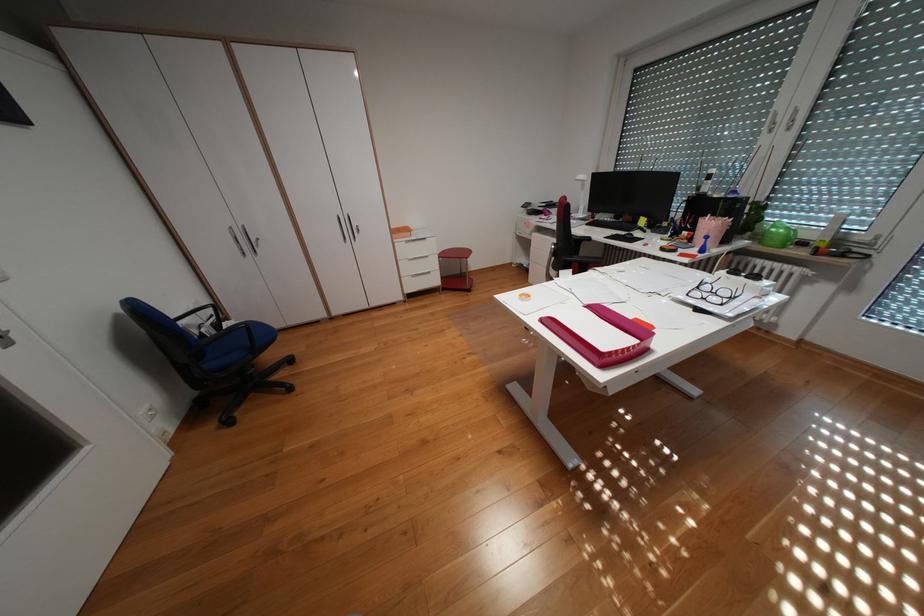
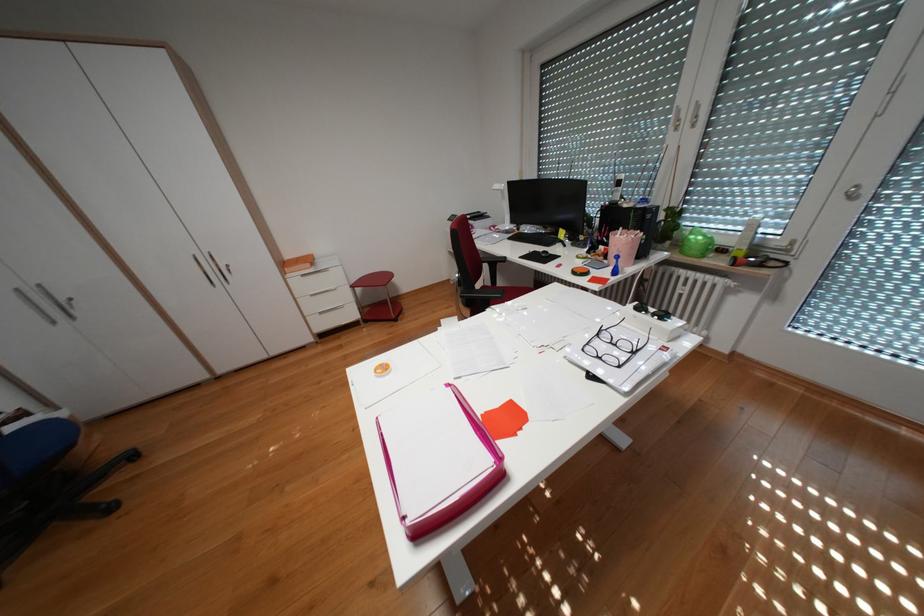
In the second image, find the point that corresponds to (702,238) in the first image.

(618, 254)